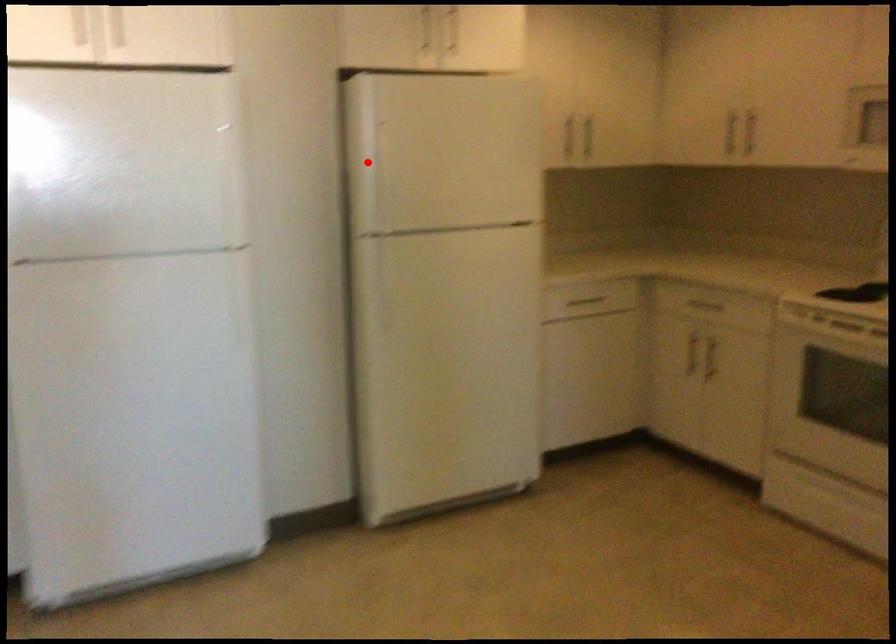
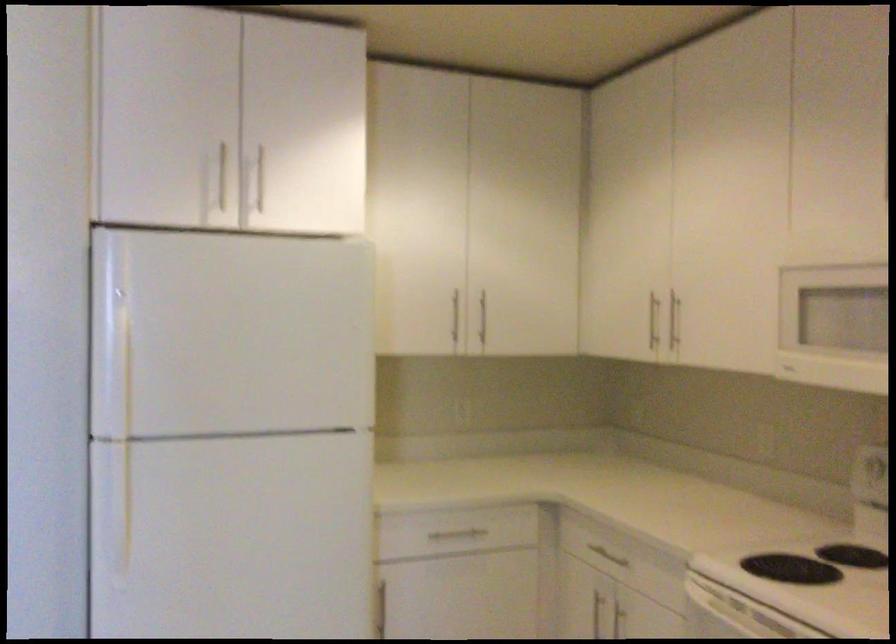
Locate, in the second image, the point that corresponds to the highlighted location in the first image.

(113, 346)